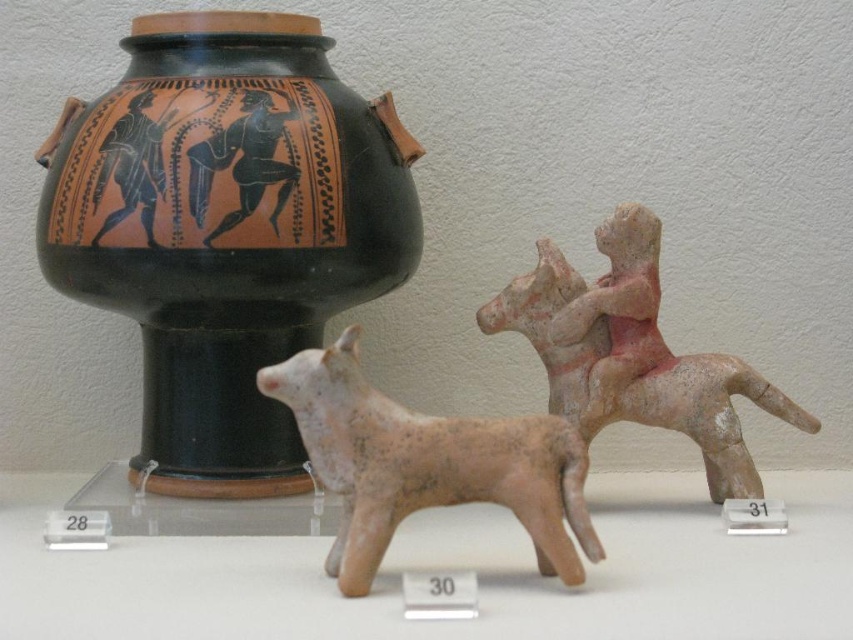
You are a museum curator arranging a new exhibit. You have two items to place on a shelf that can only hold items where the larger one is to the left of the smaller one. Do the positions of the black matte vase at upper left and the matte pink clay horse rider at right currently meet this requirement?

The black matte vase at upper left is bigger than the matte pink clay horse rider at right. Since the larger item is on the left, their current positions meet the requirement.

You are standing in front of the ancient artifacts display. There are two points marked in the image. The first point is at coordinates point [488,461] and the second is at point [714,396]. Which of these points is closer to you?

Point [488,461] is closer to the viewer than point [714,396].

You are a museum curator arranging a display. You have a black matte vase at upper left and a matte pink clay horse rider at right. The distance between them is 11.75 inches. If you need to place a label between them that must be at least 5 inches wide, will there be enough space?

The black matte vase at upper left and matte pink clay horse rider at right are 11.75 inches apart. Since the required label width is 5 inches, which is less than the distance between them, there is sufficient space to place the label between them.